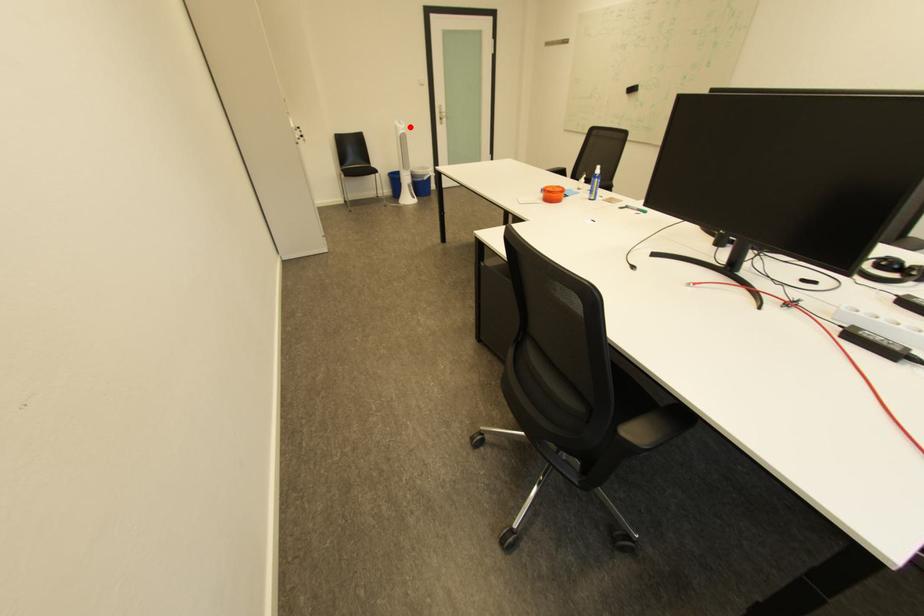
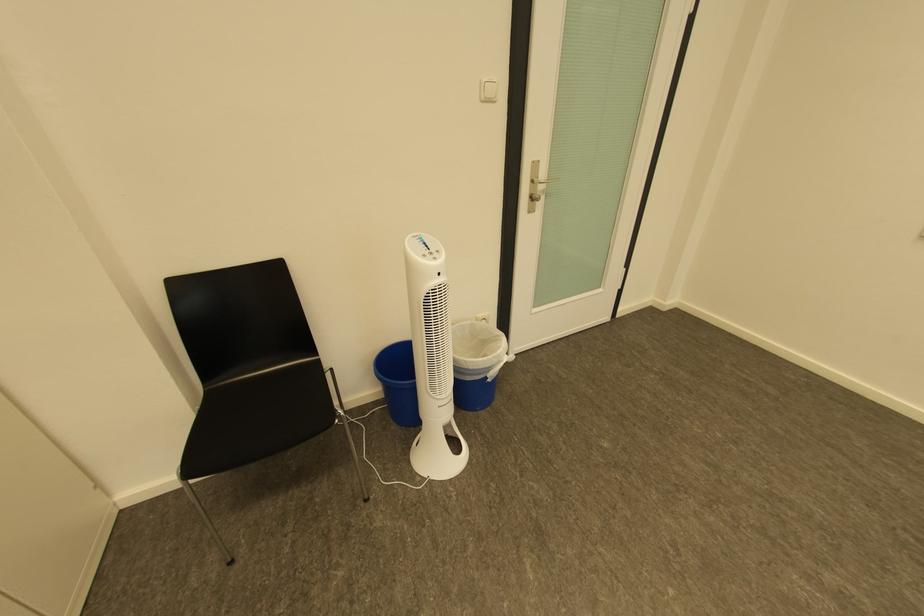
Where in the second image is the point corresponding to the highlighted location from the first image?

(439, 262)